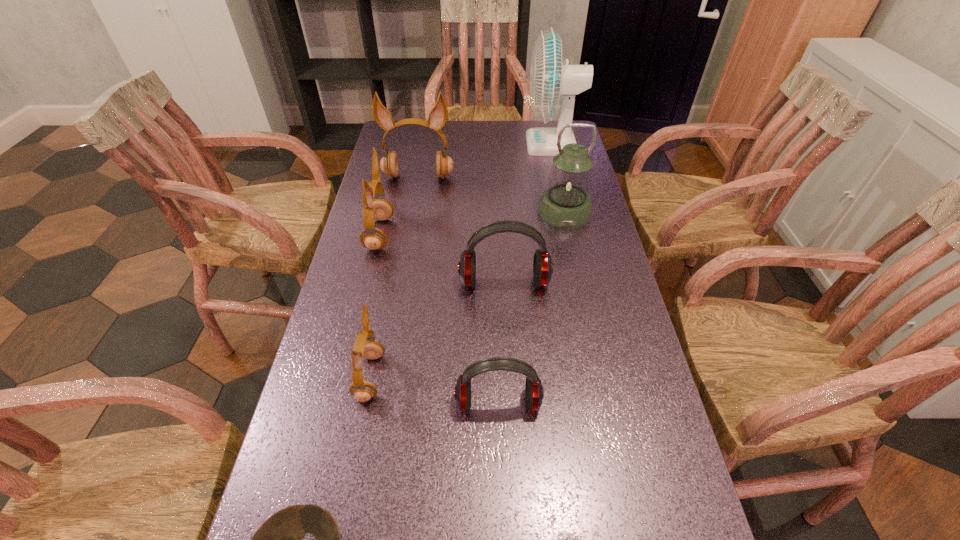
You are a GUI agent. You are given a task and a screenshot of the screen. Output one action in this format:
    pyautogui.click(x=<x>, y=<y>)
    Task: Click on the free space between the lantern and the farthest earphone
    The image size is (960, 540).
    Given the screenshot: What is the action you would take?
    pyautogui.click(x=492, y=194)

Find the location of a particular element. The width and height of the screenshot is (960, 540). free spot between the greenish lantern and the fifth nearest object is located at coordinates 535,247.

Find the location of a particular element. The width and height of the screenshot is (960, 540). vacant area that lies between the smallest brown earphone and the third shortest object is located at coordinates (434, 389).

Identify the location of free point between the white fan and the second nearest brown earphone. The height and width of the screenshot is (540, 960). (466, 190).

Choose which object is the seventh nearest neighbor to the farthest earphone. Please provide its 2D coordinates. Your answer should be formatted as a tuple, i.e. [(x, y)], where the tuple contains the x and y coordinates of a point satisfying the conditions above.

[(279, 539)]

Find the location of a particular element. This screenshot has height=540, width=960. the fifth closest object relative to the smallest brown earphone is located at coordinates (565, 539).

Where is `earphone identified as the third closest to the bigger red earphone`? The height and width of the screenshot is (540, 960). earphone identified as the third closest to the bigger red earphone is located at coordinates (534, 391).

Identify the location of earphone that is the second closest to the bigger red earphone. The height and width of the screenshot is (540, 960). (366, 346).

You are a GUI agent. You are given a task and a screenshot of the screen. Output one action in this format:
    pyautogui.click(x=<x>, y=<y>)
    Task: Click on the third closest brown earphone to the brown bowl
    
    Given the screenshot: What is the action you would take?
    click(438, 116)

Find the location of a particular element. Image resolution: width=960 pixels, height=540 pixels. brown earphone identified as the closest to the biggest brown earphone is located at coordinates (379, 209).